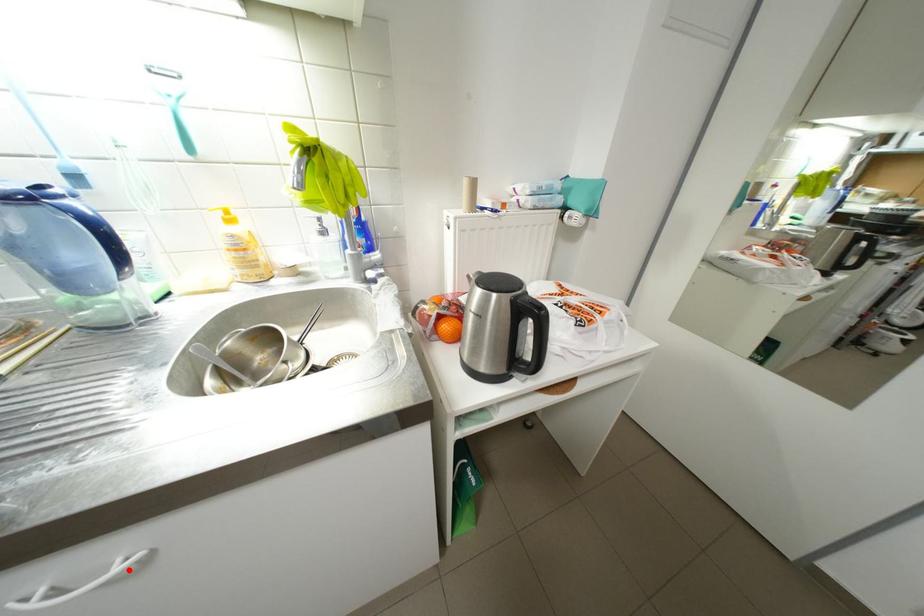
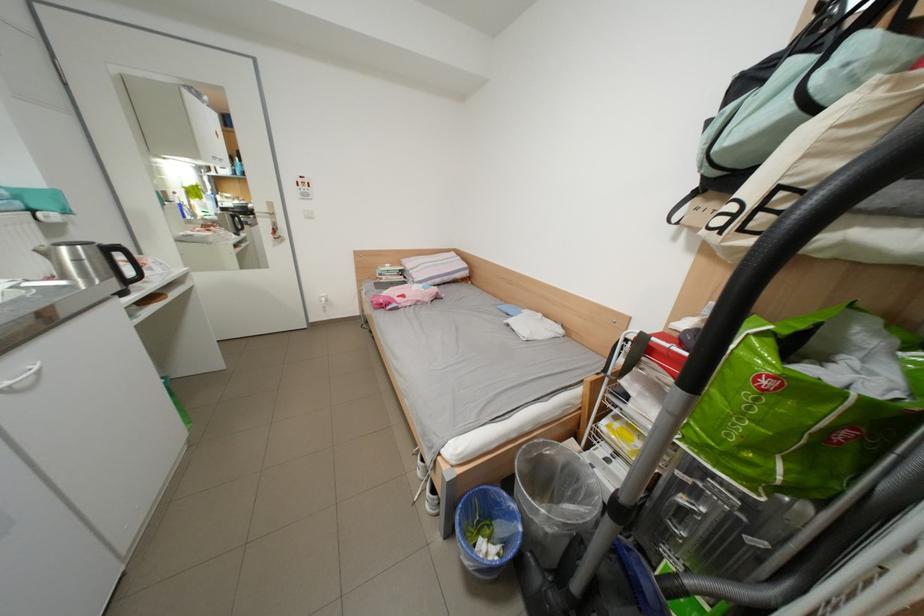
Locate, in the second image, the point that corresponds to the highlighted location in the first image.

(46, 369)